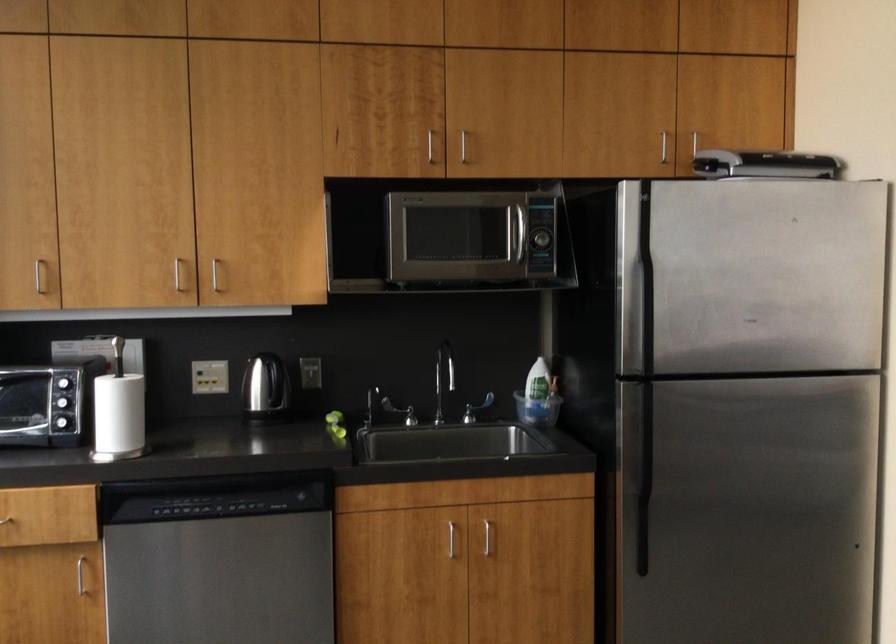
The height and width of the screenshot is (644, 896). I want to click on refrigerator door handle, so click(643, 480).